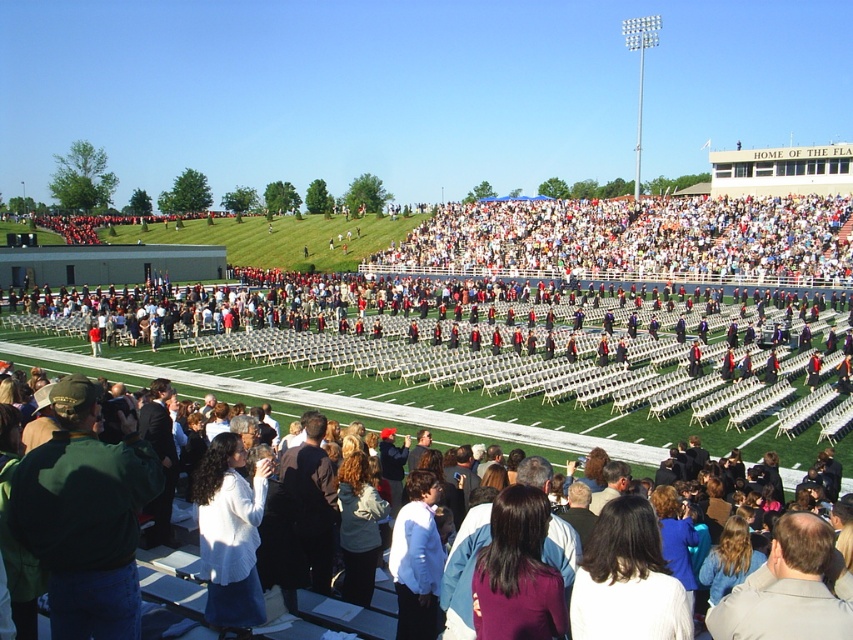
Question: Does white plastic chairs at upper center lie behind white fabric at center?

Choices:
 (A) no
 (B) yes

Answer: (B)

Question: Is white plastic chairs at upper center closer to the viewer compared to white fabric at center?

Choices:
 (A) no
 (B) yes

Answer: (A)

Question: Can you confirm if white plastic chairs at upper center is wider than white fabric at center?

Choices:
 (A) no
 (B) yes

Answer: (B)

Question: Among these points, which one is nearest to the camera?

Choices:
 (A) (753, 212)
 (B) (213, 625)

Answer: (B)